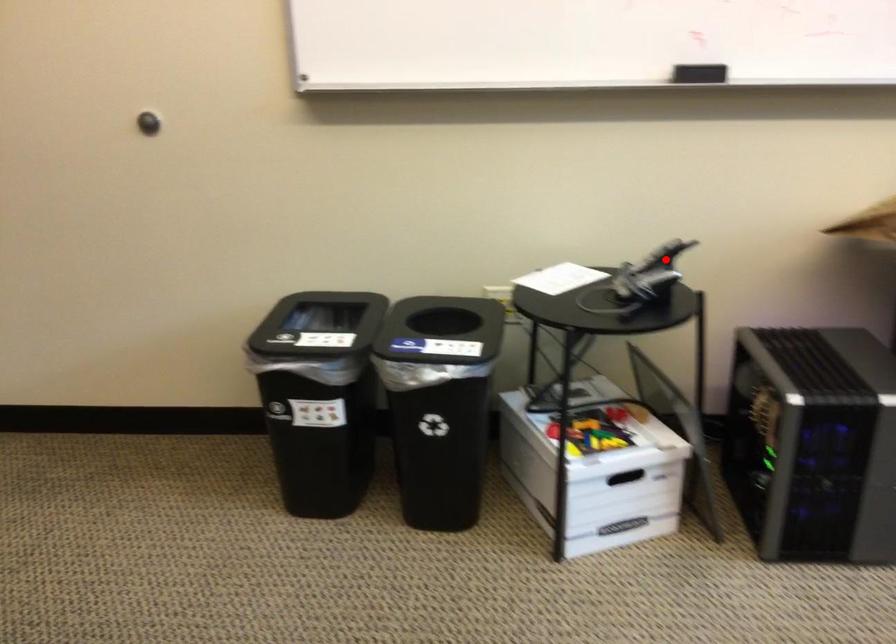
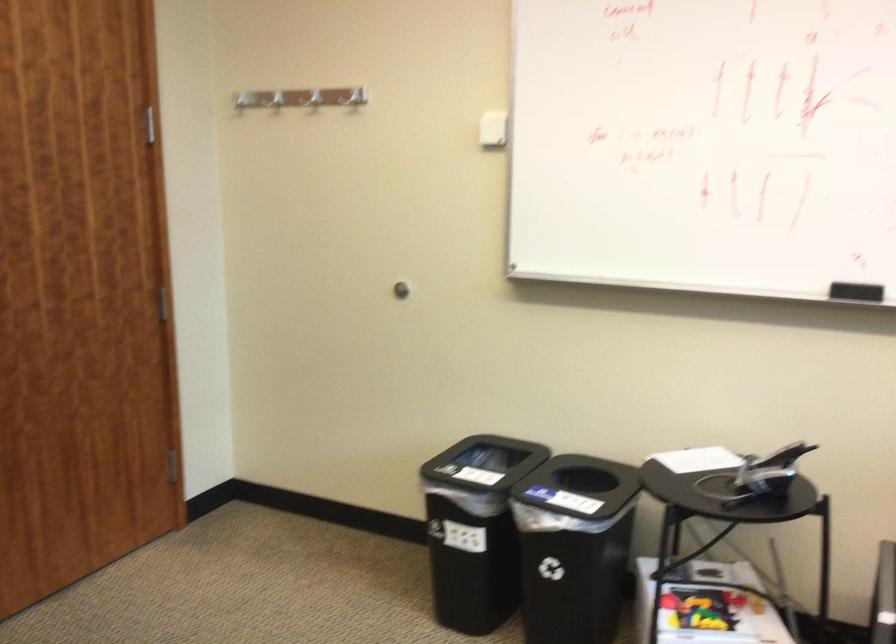
The point at the highlighted location is marked in the first image. Where is the corresponding point in the second image?

(782, 456)